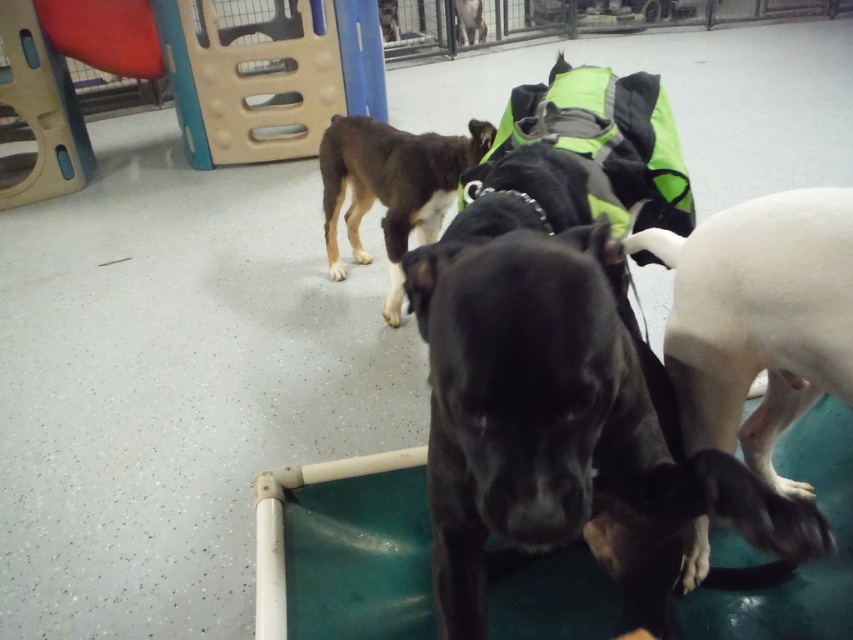
Question: Which of the following is the farthest from the observer?

Choices:
 (A) (618, 396)
 (B) (850, 202)
 (C) (399, 177)
 (D) (465, 1)

Answer: (D)

Question: Does black smooth dog at center appear over brown fur at upper left?

Choices:
 (A) no
 (B) yes

Answer: (A)

Question: Is black smooth dog at center below brown fur dog at upper center?

Choices:
 (A) no
 (B) yes

Answer: (B)

Question: Is white smooth dog at right thinner than brown fur dog at upper center?

Choices:
 (A) no
 (B) yes

Answer: (A)

Question: Which is nearer to the brown fur at upper left?

Choices:
 (A) white smooth dog at right
 (B) brown fur dog at upper center
 (C) black smooth dog at center

Answer: (A)

Question: Which object is positioned farthest from the black smooth dog at center?

Choices:
 (A) white smooth dog at right
 (B) brown fur dog at upper center

Answer: (B)